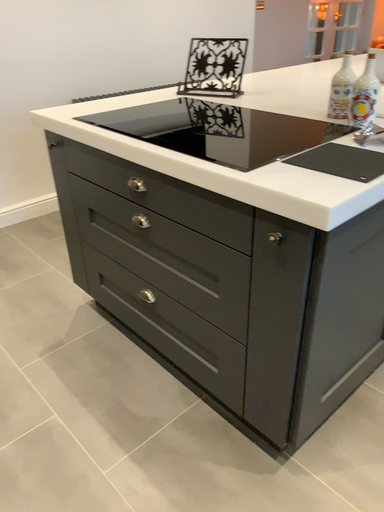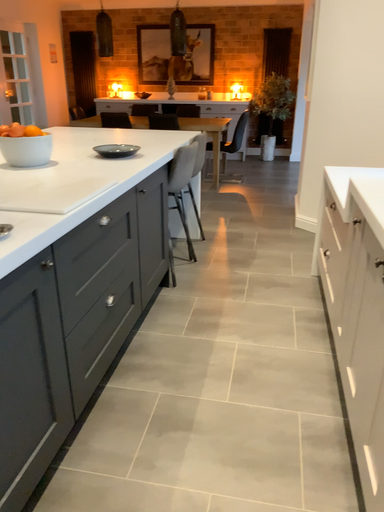
Question: How did the camera likely rotate when shooting the video?

Choices:
 (A) rotated left
 (B) rotated right

Answer: (B)